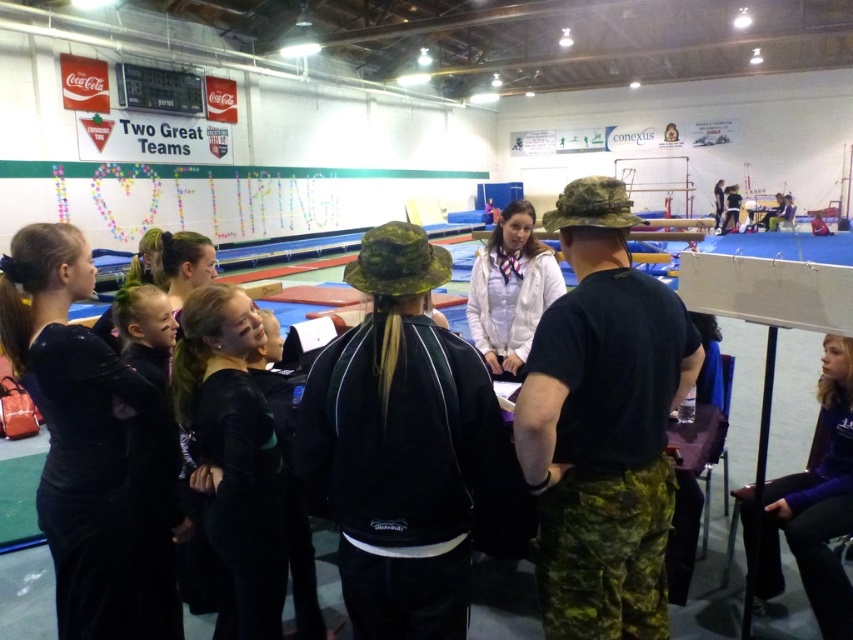
Who is higher up, purple fleece jacket at lower right or white fabric jacket at center?

white fabric jacket at center

Can you confirm if purple fleece jacket at lower right is positioned to the left of white fabric jacket at center?

Incorrect, purple fleece jacket at lower right is not on the left side of white fabric jacket at center.

Who is more distant from viewer, (839, 627) or (523, 275)?

The point (523, 275) is more distant.

Find the location of a particular element. purple fleece jacket at lower right is located at coordinates (810, 508).

Between black velvet dress at center and black matte uniform at center, which one is positioned higher?

black velvet dress at center is higher up.

Between black velvet dress at center and black matte uniform at center, which one is positioned lower?

black matte uniform at center

Who is more forward, (90, 396) or (236, 472)?

Point (90, 396)

Find the location of a particular element. Image resolution: width=853 pixels, height=640 pixels. black velvet dress at center is located at coordinates (77, 432).

Which is more to the right, black matte uniform at center or white fabric jacket at center?

Positioned to the right is white fabric jacket at center.

Is point (258, 536) positioned before point (529, 323)?

Yes, it is in front of point (529, 323).

The image size is (853, 640). I want to click on black matte uniform at center, so click(x=231, y=458).